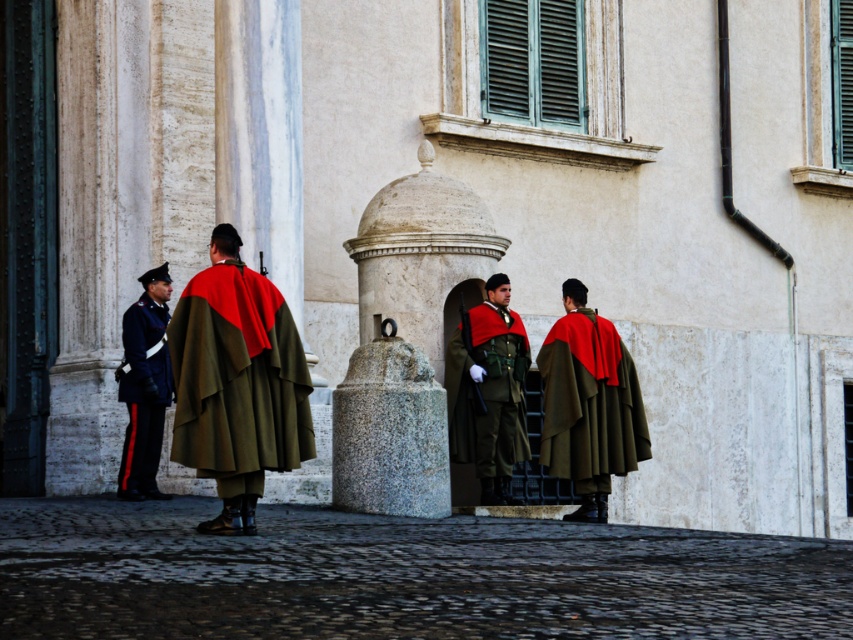
Looking at this image, which of these two, olive-green woolen cloak at center or shiny black uniform at left, stands shorter?

olive-green woolen cloak at center

Is point (230, 428) farther from camera compared to point (136, 369)?

No.

Between point (282, 378) and point (141, 326), which one is positioned behind?

Point (141, 326)

The image size is (853, 640). I want to click on olive-green woolen cloak at center, so click(236, 380).

At what (x,y) coordinates should I click in order to perform the action: click on olive-green woolen cloak at center. Please return your answer as a coordinate pair (x, y). Image resolution: width=853 pixels, height=640 pixels. Looking at the image, I should click on (236, 380).

Is the position of olive-green woolen cloak at center more distant than that of matte green uniform at center?

That is False.

Who is more forward, (215, 454) or (512, 321)?

Point (215, 454) is more forward.

Find the location of `olive-green woolen cloak at center`. olive-green woolen cloak at center is located at coordinates (236, 380).

Is matte olive-green cloak at right shorter than shiny black uniform at left?

Yes, matte olive-green cloak at right is shorter than shiny black uniform at left.

Is matte olive-green cloak at right to the right of shiny black uniform at left from the viewer's perspective?

Correct, you'll find matte olive-green cloak at right to the right of shiny black uniform at left.

Between point (599, 346) and point (132, 484), which one is positioned behind?

The point (599, 346) is behind.

I want to click on matte olive-green cloak at right, so click(x=589, y=403).